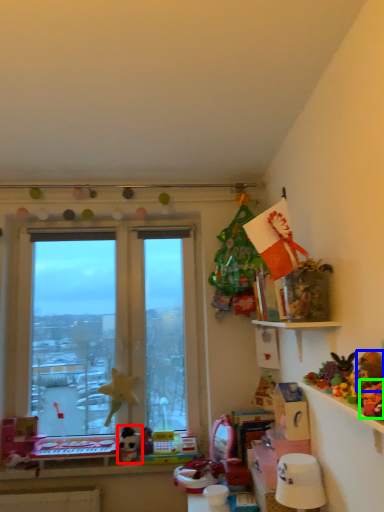
Question: Considering the real-world distances, which object is farthest from toy (highlighted by a red box)? toy (highlighted by a blue box) or toy (highlighted by a green box)?

Choices:
 (A) toy
 (B) toy

Answer: (B)